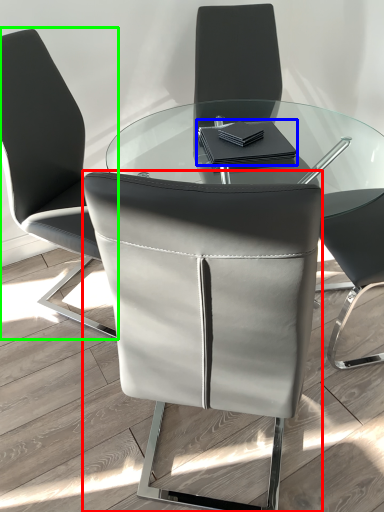
Question: Considering the real-world distances, which object is closest to chair (highlighted by a red box)? notebook (highlighted by a blue box) or chair (highlighted by a green box).

Choices:
 (A) notebook
 (B) chair

Answer: (A)